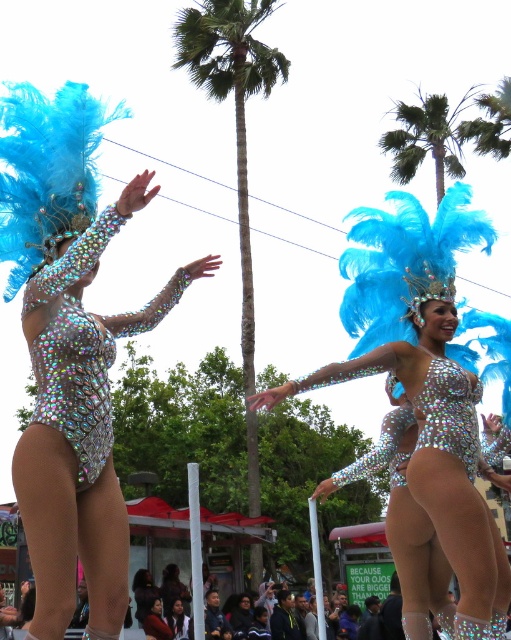
Can you confirm if holographic sequin bodysuit at center is taller than matte black jacket at lower center?

Yes, holographic sequin bodysuit at center is taller than matte black jacket at lower center.

Is holographic sequin bodysuit at center in front of matte black jacket at lower center?

Yes, it is.

Who is more forward, (461, 413) or (146, 632)?

Point (461, 413) is in front.

Image resolution: width=511 pixels, height=640 pixels. I want to click on holographic sequin bodysuit at center, so click(433, 480).

Is green textured palm tree at center above green leafy palm tree at upper center?

Actually, green textured palm tree at center is below green leafy palm tree at upper center.

Is point (245, 1) behind point (388, 109)?

That is False.

Locate an element on the screen. The height and width of the screenshot is (640, 511). green textured palm tree at center is located at coordinates (234, 104).

Between green leafy palm tree at upper center and matte black hair at center, which one has less height?

green leafy palm tree at upper center

Can you confirm if green leafy palm tree at upper center is positioned below matte black hair at center?

Actually, green leafy palm tree at upper center is above matte black hair at center.

Which is behind, point (452, 145) or point (173, 612)?

The point (452, 145) is behind.

Find the location of a particular element. green leafy palm tree at upper center is located at coordinates (427, 138).